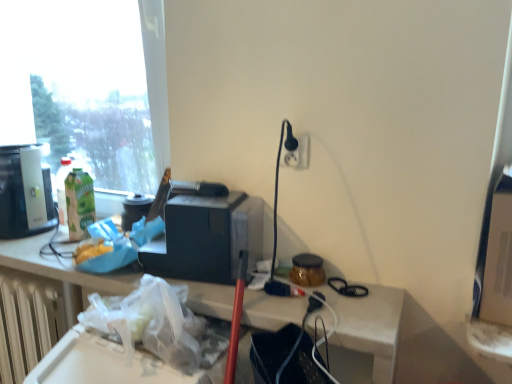
Question: Does translucent glass jar at center, acting as the 1th appliance starting from the right, have a greater width compared to black plastic toaster at center, which is the 1th appliance in left-to-right order?

Choices:
 (A) yes
 (B) no

Answer: (B)

Question: Does translucent glass jar at center, positioned as the 2th appliance in left-to-right order, have a lesser height compared to black plastic toaster at center, which is the second appliance in right-to-left order?

Choices:
 (A) no
 (B) yes

Answer: (B)

Question: Is black plastic toaster at center, which is the 1th appliance in left-to-right order, at the back of translucent glass jar at center, acting as the 1th appliance starting from the right?

Choices:
 (A) yes
 (B) no

Answer: (B)

Question: From the image's perspective, would you say translucent glass jar at center, acting as the 1th appliance starting from the right, is shown under black plastic toaster at center, which is the 1th appliance in left-to-right order?

Choices:
 (A) yes
 (B) no

Answer: (A)

Question: Considering the relative positions of translucent glass jar at center, positioned as the 2th appliance in left-to-right order, and black plastic toaster at center, which is the second appliance in right-to-left order, in the image provided, is translucent glass jar at center, positioned as the 2th appliance in left-to-right order, to the left of black plastic toaster at center, which is the second appliance in right-to-left order, from the viewer's perspective?

Choices:
 (A) no
 (B) yes

Answer: (A)

Question: Do you think green matte carton at left is within transparent glass window at upper left, or outside of it?

Choices:
 (A) outside
 (B) inside

Answer: (A)

Question: In terms of width, does green matte carton at left look wider or thinner when compared to transparent glass window at upper left?

Choices:
 (A) thin
 (B) wide

Answer: (A)

Question: From the image's perspective, is green matte carton at left above or below transparent glass window at upper left?

Choices:
 (A) below
 (B) above

Answer: (A)

Question: From a real-world perspective, is green matte carton at left physically located above or below transparent glass window at upper left?

Choices:
 (A) above
 (B) below

Answer: (B)

Question: Considering the positions of point (77, 238) and point (0, 362), is point (77, 238) closer or farther from the camera than point (0, 362)?

Choices:
 (A) farther
 (B) closer

Answer: (B)

Question: Is green matte carton at left spatially inside white plastic radiator at lower left, or outside of it?

Choices:
 (A) inside
 (B) outside

Answer: (B)

Question: Looking at the image, does green matte carton at left seem bigger or smaller compared to white plastic radiator at lower left?

Choices:
 (A) big
 (B) small

Answer: (B)

Question: Is green matte carton at left to the left or to the right of white plastic radiator at lower left in the image?

Choices:
 (A) right
 (B) left

Answer: (A)

Question: Considering the positions of point (287, 162) and point (16, 236), is point (287, 162) closer or farther from the camera than point (16, 236)?

Choices:
 (A) farther
 (B) closer

Answer: (B)

Question: Looking at the image, does white plastic electric outlet at upper right seem bigger or smaller compared to matte black coffee machine at left?

Choices:
 (A) small
 (B) big

Answer: (A)